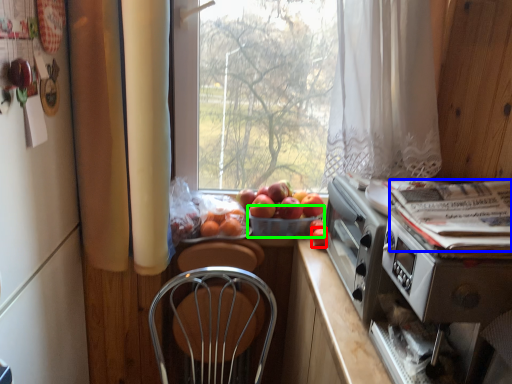
Question: Considering the real-world distances, which object is closest to fruit (highlighted by a red box)? magazine (highlighted by a blue box) or basket (highlighted by a green box).

Choices:
 (A) magazine
 (B) basket

Answer: (B)